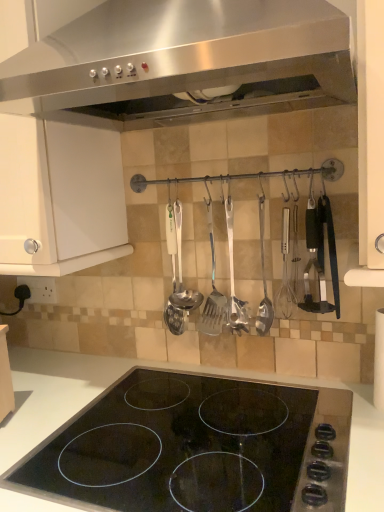
Question: Is white matte cabinet at upper left looking in the opposite direction of polished stainless steel ladle at center, the 4th silverware viewed from the right?

Choices:
 (A) no
 (B) yes

Answer: (A)

Question: Is white matte cabinet at upper left to the right of polished stainless steel ladle at center, which is counted as the first silverware, starting from the left, from the viewer's perspective?

Choices:
 (A) no
 (B) yes

Answer: (A)

Question: Is white matte cabinet at upper left positioned far away from polished stainless steel ladle at center, the 4th silverware viewed from the right?

Choices:
 (A) yes
 (B) no

Answer: (B)

Question: Are white matte cabinet at upper left and polished stainless steel ladle at center, which is counted as the first silverware, starting from the left, making contact?

Choices:
 (A) no
 (B) yes

Answer: (A)

Question: Is the position of white matte cabinet at upper left less distant than that of polished stainless steel ladle at center, which is counted as the first silverware, starting from the left?

Choices:
 (A) yes
 (B) no

Answer: (A)

Question: From the image's perspective, is polished stainless steel ladle at center, the 4th silverware viewed from the right, positioned above or below polished stainless steel spatula at center, marked as the 3th silverware in a left-to-right arrangement?

Choices:
 (A) above
 (B) below

Answer: (B)

Question: Is polished stainless steel ladle at center, the 4th silverware viewed from the right, situated inside polished stainless steel spatula at center, marked as the 3th silverware in a left-to-right arrangement, or outside?

Choices:
 (A) inside
 (B) outside

Answer: (B)

Question: In the image, is polished stainless steel ladle at center, which is counted as the first silverware, starting from the left, on the left side or the right side of polished stainless steel spatula at center, marked as the 3th silverware in a left-to-right arrangement?

Choices:
 (A) left
 (B) right

Answer: (A)

Question: Is polished stainless steel ladle at center, which is counted as the first silverware, starting from the left, wider or thinner than polished stainless steel spatula at center, placed as the 2th silverware when sorted from right to left?

Choices:
 (A) wide
 (B) thin

Answer: (A)

Question: In terms of height, does black glass stovetop at center look taller or shorter compared to stainless steel range hood at upper center?

Choices:
 (A) tall
 (B) short

Answer: (B)

Question: Based on their sizes in the image, would you say black glass stovetop at center is bigger or smaller than stainless steel range hood at upper center?

Choices:
 (A) big
 (B) small

Answer: (B)

Question: From a real-world perspective, relative to stainless steel range hood at upper center, is black glass stovetop at center vertically above or below?

Choices:
 (A) below
 (B) above

Answer: (A)

Question: Is point (187, 366) closer or farther from the camera than point (203, 117)?

Choices:
 (A) closer
 (B) farther

Answer: (B)

Question: From the image's perspective, is polished stainless steel spatula at center, marked as the 3th silverware in a left-to-right arrangement, positioned above or below black glass stovetop at center?

Choices:
 (A) above
 (B) below

Answer: (A)

Question: Relative to black glass stovetop at center, is polished stainless steel spatula at center, marked as the 3th silverware in a left-to-right arrangement, in front or behind?

Choices:
 (A) front
 (B) behind

Answer: (B)